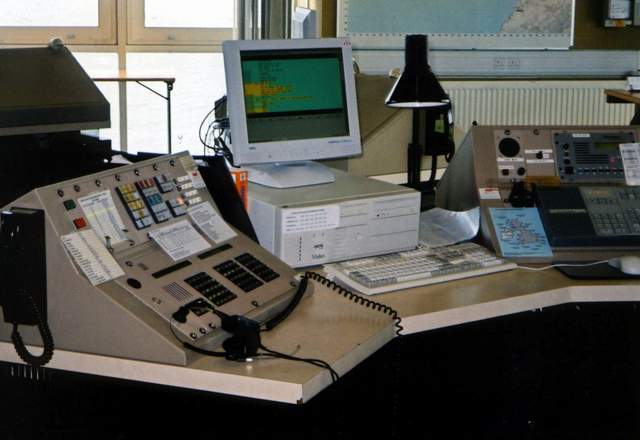
Where is `audio cable`? The height and width of the screenshot is (440, 640). audio cable is located at coordinates (356, 298).